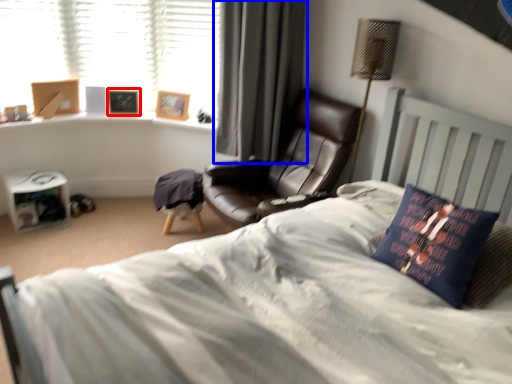
Question: Which of the following is the closest to the observer, picture frame (highlighted by a red box) or curtain (highlighted by a blue box)?

Choices:
 (A) picture frame
 (B) curtain

Answer: (B)